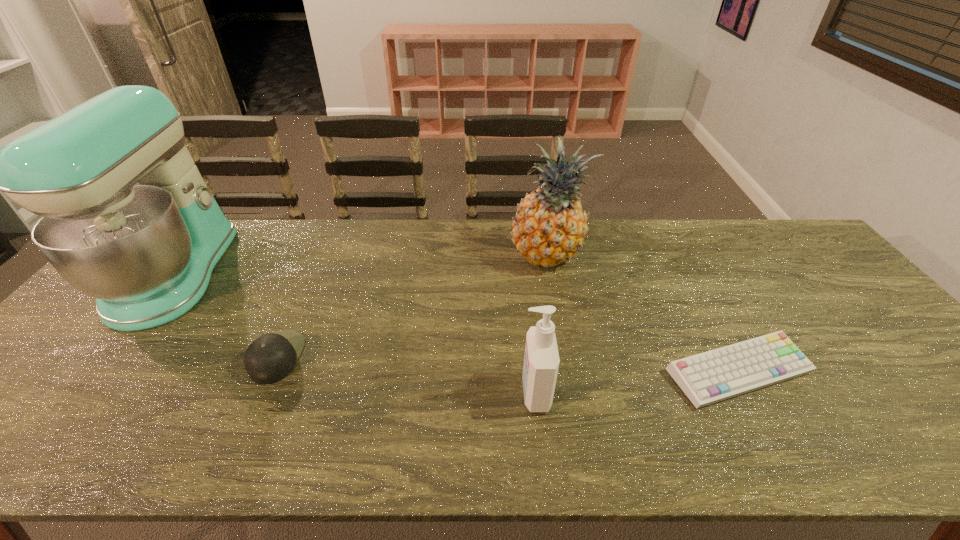
Find the location of `the tallest object`. the tallest object is located at coordinates (127, 218).

The image size is (960, 540). Identify the location of mixer. (127, 218).

Locate an element on the screen. the fourth shortest object is located at coordinates (549, 227).

Image resolution: width=960 pixels, height=540 pixels. Identify the location of cleansing agent. [x=541, y=359].

Where is `the second object from left to right`? The height and width of the screenshot is (540, 960). the second object from left to right is located at coordinates (270, 358).

At what (x,y) coordinates should I click in order to perform the action: click on cap. Please return your answer as a coordinate pair (x, y). The height and width of the screenshot is (540, 960). Looking at the image, I should click on (270, 358).

Where is `computer keyboard`? This screenshot has height=540, width=960. computer keyboard is located at coordinates (713, 376).

At what (x,y) coordinates should I click in order to perform the action: click on the rightmost object. Please return your answer as a coordinate pair (x, y). The height and width of the screenshot is (540, 960). Looking at the image, I should click on (713, 376).

At what (x,y) coordinates should I click in order to perform the action: click on vacant area situated 0.330m at the base of the tallest object. Please return your answer as a coordinate pair (x, y). Looking at the image, I should click on (334, 274).

The height and width of the screenshot is (540, 960). Find the location of `vacant point located 0.400m on the front of the pineapple`. vacant point located 0.400m on the front of the pineapple is located at coordinates (574, 396).